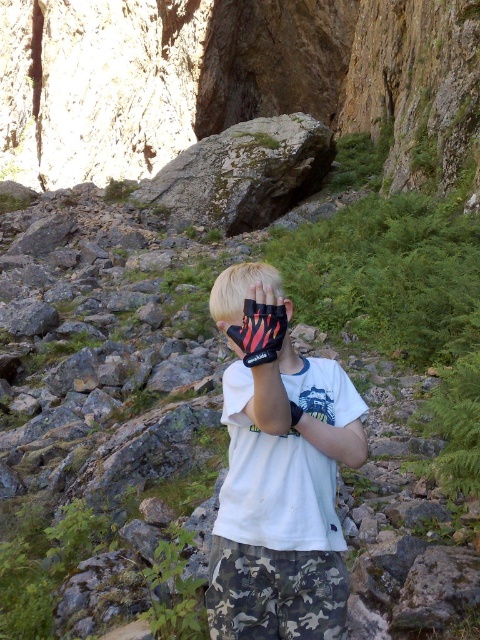
Question: From the image, what is the correct spatial relationship of white matte shirt at center in relation to camo fabric shorts at lower center?

Choices:
 (A) left
 (B) right

Answer: (B)

Question: Which is farther from the black mesh glove at center?

Choices:
 (A) white matte shirt at center
 (B) green mossy rock at upper center
 (C) camo fabric shorts at lower center

Answer: (B)

Question: Is green mossy rock at upper center further to the viewer compared to black mesh glove at center?

Choices:
 (A) yes
 (B) no

Answer: (A)

Question: Is camo fabric shorts at lower center closer to camera compared to black mesh glove at center?

Choices:
 (A) yes
 (B) no

Answer: (B)

Question: Which point is closer to the camera taking this photo?

Choices:
 (A) (245, 323)
 (B) (160, 200)
 (C) (276, 406)

Answer: (C)

Question: Based on their relative distances, which object is farther from the camo fabric shorts at lower center?

Choices:
 (A) black mesh glove at center
 (B) green mossy rock at upper center
 (C) white matte shirt at center

Answer: (B)